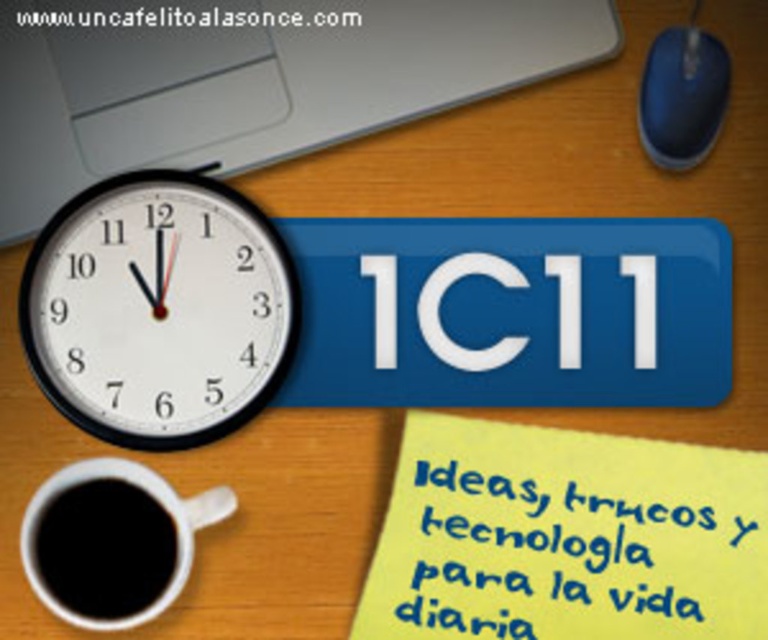
You are organizing your desk and want to place a new item between the blue plastic mouse at upper right and the white paper at upper center. Based on their current positions, where should you place the new item?

The blue plastic mouse at upper right is positioned on the right side of white paper at upper center, so the new item should be placed between them, to the right of the white paper at upper center and to the left of the blue plastic mouse at upper right.

You are organizing your desk and want to place a new item between the silver metallic laptop at upper left and the blue plastic mouse at upper right. Based on their positions, which object will the new item be closer to?

The new item will be closer to the silver metallic laptop at upper left because it is closer to the viewer compared to the blue plastic mouse at upper right.

You are standing at the position of the camera looking at the workspace. There are two points marked on the desk, point 1 at coordinates (644,112) and point 2 at coordinates (118,13). Which point is closer to you?

Point 1 at coordinates (644,112) is closer to the camera than point 2 at coordinates (118,13).